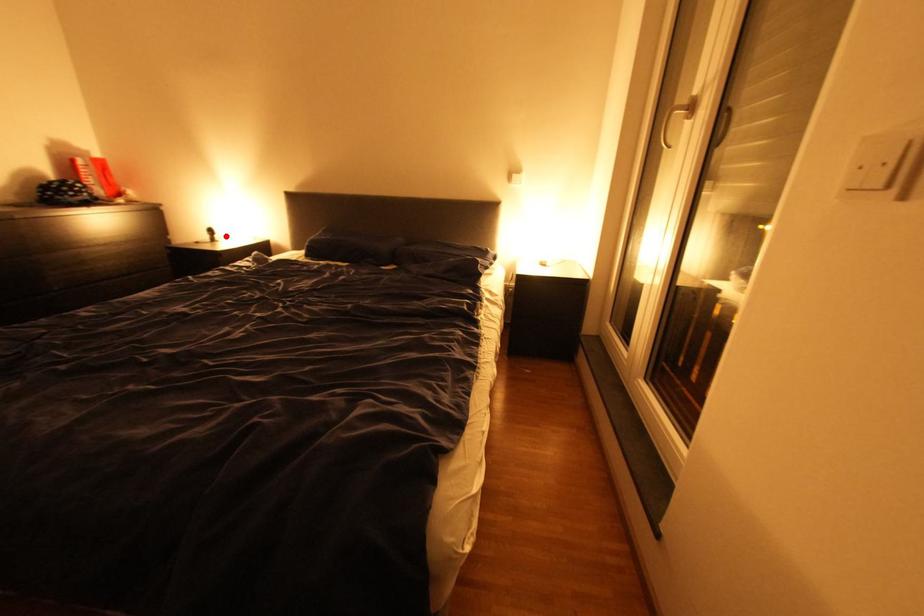
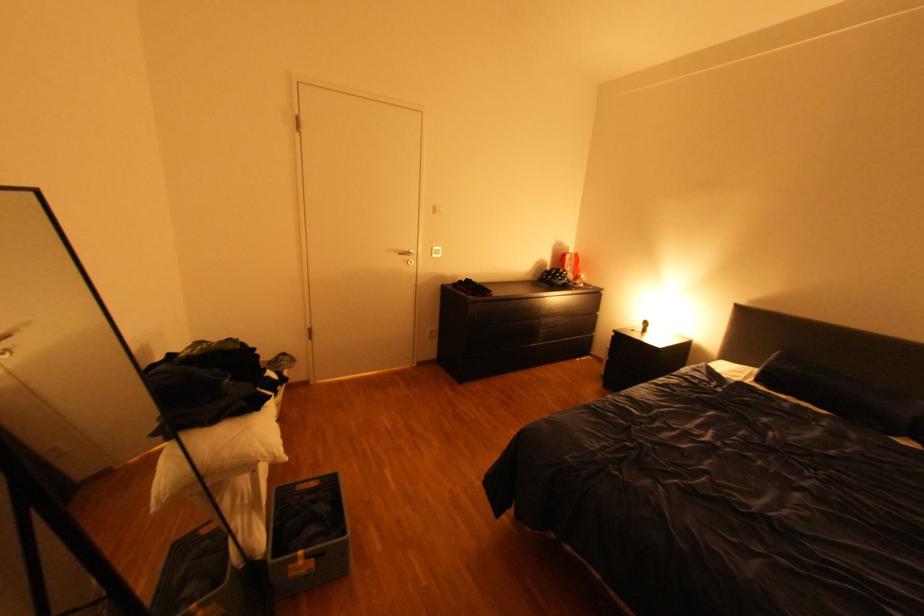
Locate, in the second image, the point that corresponds to the highlighted location in the first image.

(659, 328)